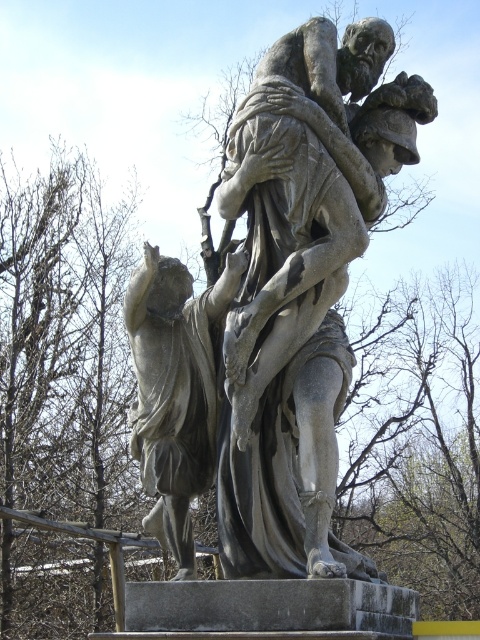
Question: Is gray stone sculpture at center positioned at the back of matte gray statue at center?

Choices:
 (A) yes
 (B) no

Answer: (B)

Question: Does gray stone sculpture at center come in front of matte gray statue at center?

Choices:
 (A) yes
 (B) no

Answer: (A)

Question: Which point is closer to the camera?

Choices:
 (A) gray stone sculpture at center
 (B) matte gray statue at center

Answer: (A)

Question: Which point is farther to the camera?

Choices:
 (A) (232, 282)
 (B) (276, 563)

Answer: (A)

Question: Can you confirm if gray stone sculpture at center is wider than matte gray statue at center?

Choices:
 (A) no
 (B) yes

Answer: (B)